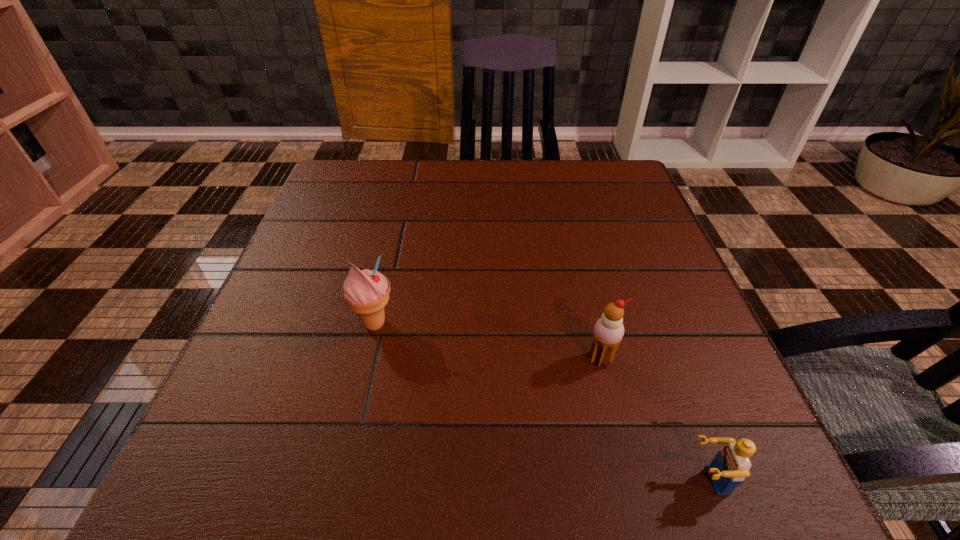
Locate which object is the second closest to the shortest object. Please provide its 2D coordinates. Your answer should be formatted as a tuple, i.e. [(x, y)], where the tuple contains the x and y coordinates of a point satisfying the conditions above.

[(366, 292)]